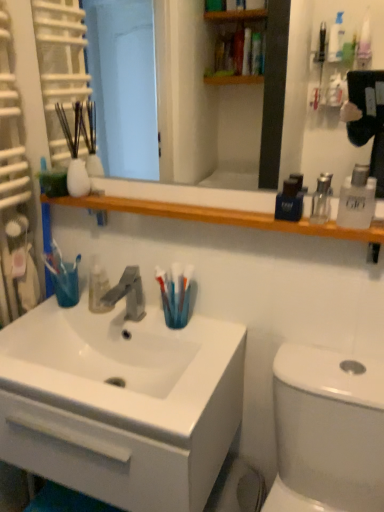
Locate an element on the screen. The height and width of the screenshot is (512, 384). vacant space positioned to the left of blue glossy mouthwash at upper right, positioned as the third mouthwash in right-to-left order is located at coordinates (233, 214).